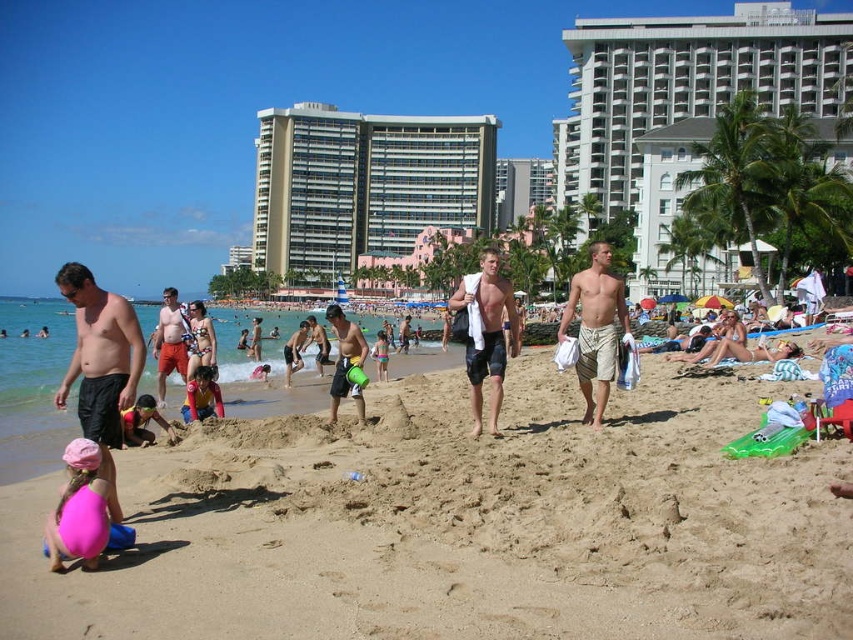
Is point (344, 445) positioned in front of point (564, 168)?

Yes, it is.

Can you confirm if beige sandy beach at center is smaller than white concrete building at upper center?

Yes, beige sandy beach at center is smaller than white concrete building at upper center.

The image size is (853, 640). What do you see at coordinates (461, 524) in the screenshot?
I see `beige sandy beach at center` at bounding box center [461, 524].

Locate an element on the screen. The width and height of the screenshot is (853, 640). beige sandy beach at center is located at coordinates (461, 524).

Is beige sandy beach at center smaller than matte red shorts at center?

Yes, beige sandy beach at center is smaller than matte red shorts at center.

Between beige sandy beach at center and matte red shorts at center, which one has less height?

With less height is beige sandy beach at center.

Is point (244, 538) closer to viewer compared to point (184, 321)?

Yes, it is.

Image resolution: width=853 pixels, height=640 pixels. I want to click on beige sandy beach at center, so click(461, 524).

Who is more forward, (653, 225) or (183, 364)?

Positioned in front is point (183, 364).

Is white concrete building at upper center positioned behind matte red shorts at center?

Yes, it is behind matte red shorts at center.

Does point (640, 164) come behind point (158, 324)?

Yes, point (640, 164) is farther from viewer.

I want to click on white concrete building at upper center, so click(685, 109).